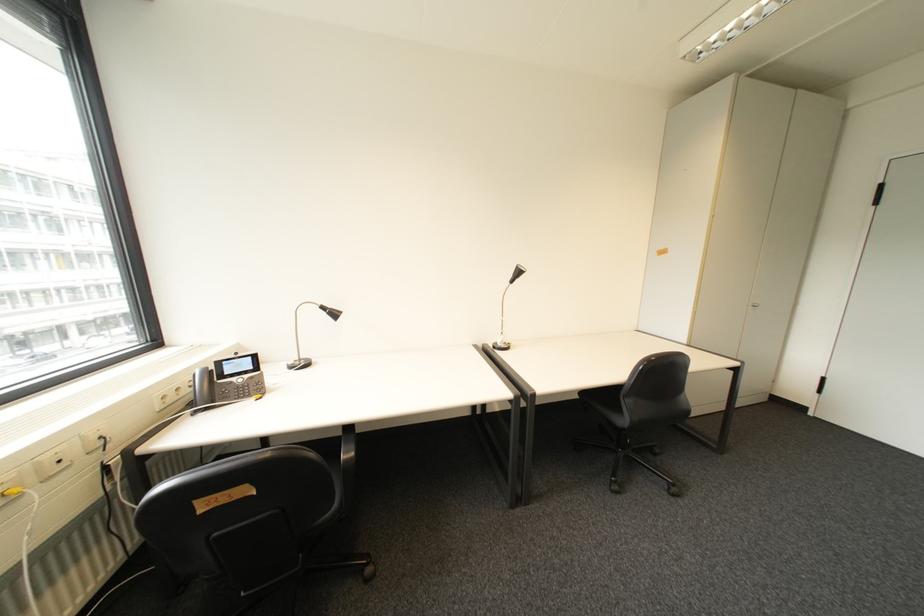
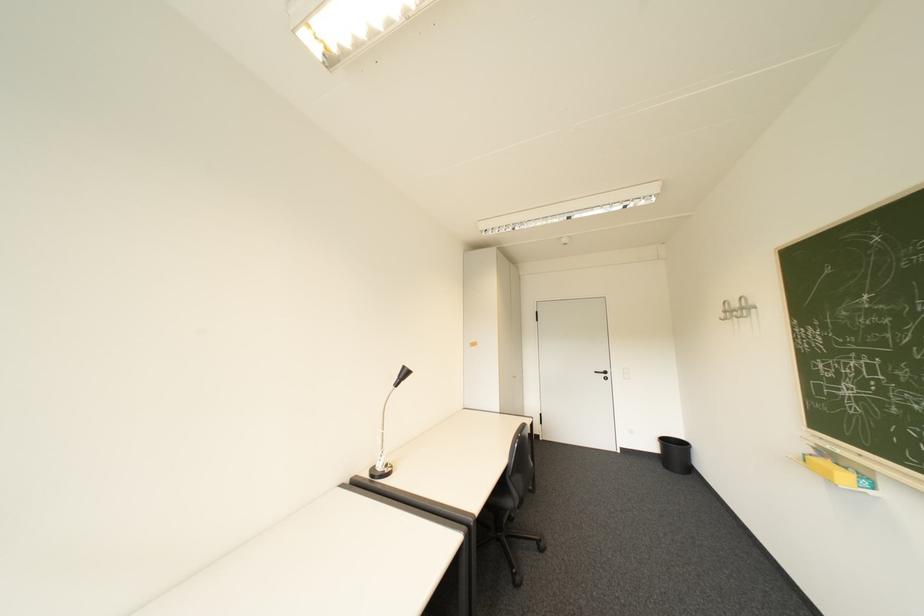
Question: Based on the continuous images, in which direction is the camera rotating? Reply with the corresponding letter.

Choices:
 (A) Left
 (B) Right
 (C) Up
 (D) Down

Answer: (B)